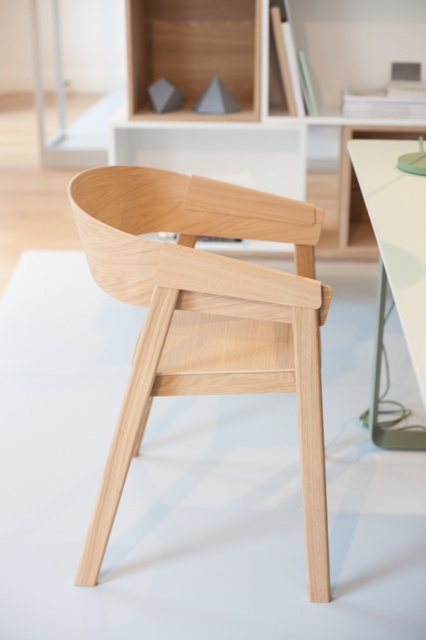
Question: Which point is farther from the camera taking this photo?

Choices:
 (A) (377, 205)
 (B) (298, 326)

Answer: (A)

Question: Does natural wood chair at center have a lesser width compared to white glossy table at right?

Choices:
 (A) no
 (B) yes

Answer: (A)

Question: Can you confirm if natural wood chair at center is positioned to the right of white glossy table at right?

Choices:
 (A) no
 (B) yes

Answer: (A)

Question: Is natural wood chair at center wider than white glossy table at right?

Choices:
 (A) yes
 (B) no

Answer: (A)